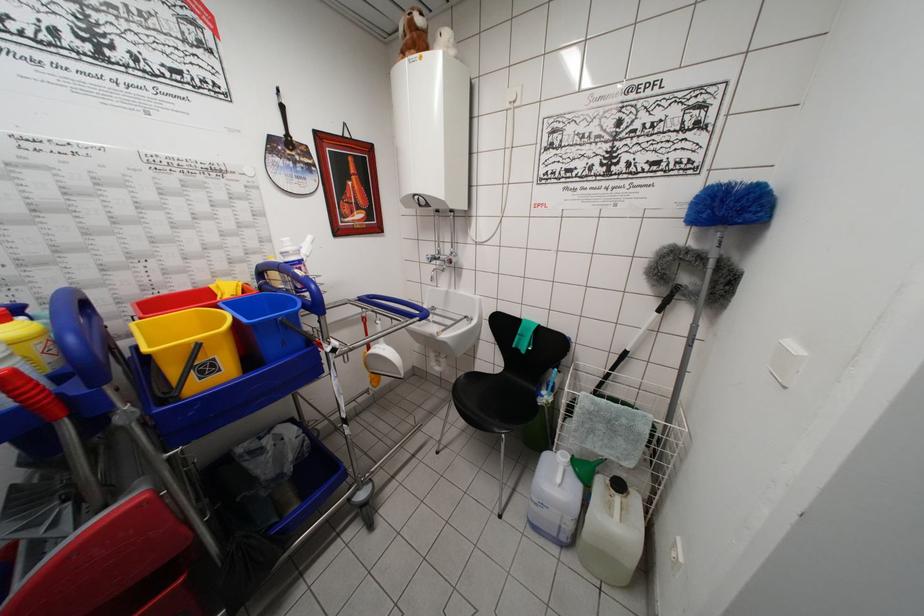
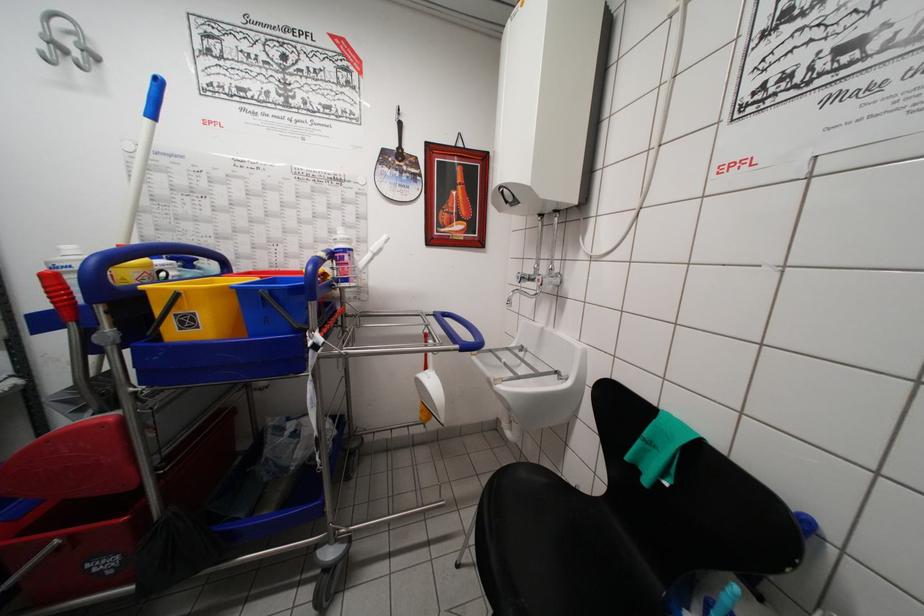
Question: The images are taken continuously from a first-person perspective. In which direction is your viewpoint rotating?

Choices:
 (A) Left
 (B) Right
 (C) Up
 (D) Down

Answer: (A)